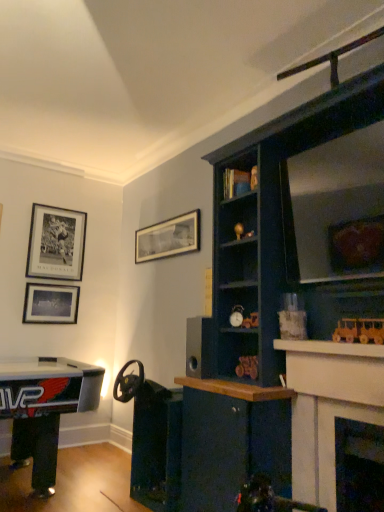
Question: Is black matte speaker at center situated inside matte black picture frame at upper left, positioned as the 1th picture frame in left-to-right order, or outside?

Choices:
 (A) outside
 (B) inside

Answer: (A)

Question: Is point (206, 333) closer or farther from the camera than point (61, 315)?

Choices:
 (A) closer
 (B) farther

Answer: (A)

Question: Which of these objects is positioned closest to the wooden train at right, the 5th toy from the back?

Choices:
 (A) gold metallic ball at upper center, which is the fourth toy in right-to-left order
 (B) metallic gold toy car at center-right, the second toy positioned from the front
 (C) white glossy fireplace at upper right, which is counted as the 2th fireplace, starting from the right
 (D) black matte speaker at center
 (E) matte black alarm clock at center, the fifth toy when ordered from right to left

Answer: (C)

Question: Based on their relative distances, which object is nearer to the wooden train at right, the 5th toy from the back?

Choices:
 (A) white glossy fireplace at upper right, acting as the 1th fireplace starting from the left
 (B) matte black picture frame at upper left, acting as the 2th picture frame starting from the right
 (C) metallic gold toy car at center-right, marked as the third toy in a left-to-right arrangement
 (D) black matte speaker at center
 (E) matte black picture frame at upper left, positioned as the 1th picture frame in left-to-right order

Answer: (A)